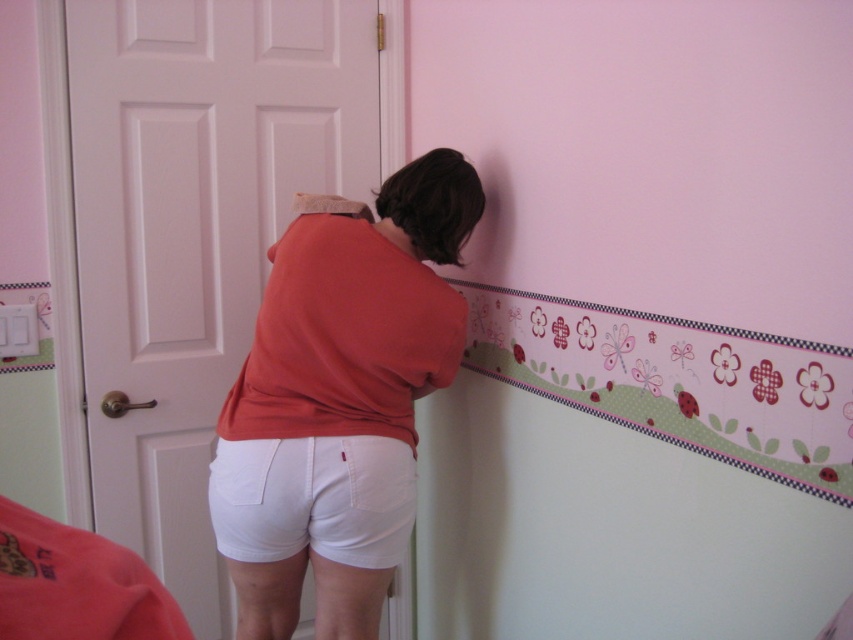
Is matte orange shirt at center to the right of white cotton shorts at lower center from the viewer's perspective?

Indeed, matte orange shirt at center is positioned on the right side of white cotton shorts at lower center.

Can you confirm if matte orange shirt at center is smaller than white cotton shorts at lower center?

No.

Describe the element at coordinates (340, 401) in the screenshot. Image resolution: width=853 pixels, height=640 pixels. I see `matte orange shirt at center` at that location.

I want to click on matte orange shirt at center, so click(340, 401).